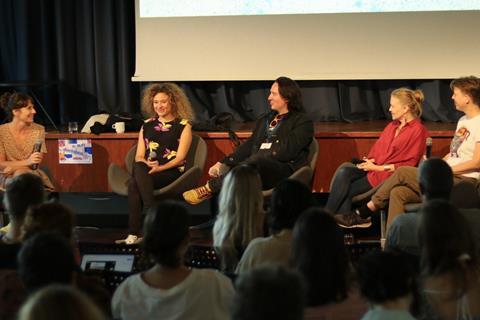
Locate an element on the screen. The image size is (480, 320). spotlight is located at coordinates (369, 128).